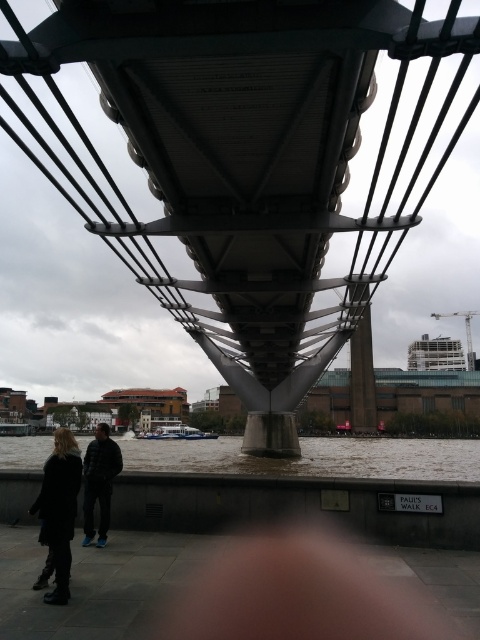
Question: Is brown water at lower center to the left of dark gray jacket at lower left from the viewer's perspective?

Choices:
 (A) yes
 (B) no

Answer: (A)

Question: Where is metallic gray suspension bridge at center located in relation to brown water at lower center in the image?

Choices:
 (A) below
 (B) above

Answer: (B)

Question: Considering the real-world distances, which object is farthest from the dark gray jacket at lower left?

Choices:
 (A) metallic gray suspension bridge at center
 (B) brown water at lower center

Answer: (B)

Question: Estimate the real-world distances between objects in this image. Which object is farther from the metallic gray suspension bridge at center?

Choices:
 (A) dark gray jacket at lower left
 (B) brown water at lower center
 (C) black wool coat at lower left

Answer: (C)

Question: Which object is positioned farthest from the dark gray jacket at lower left?

Choices:
 (A) metallic gray suspension bridge at center
 (B) brown water at lower center
 (C) black wool coat at lower left

Answer: (B)

Question: Does metallic gray suspension bridge at center appear over brown water at lower center?

Choices:
 (A) yes
 (B) no

Answer: (A)